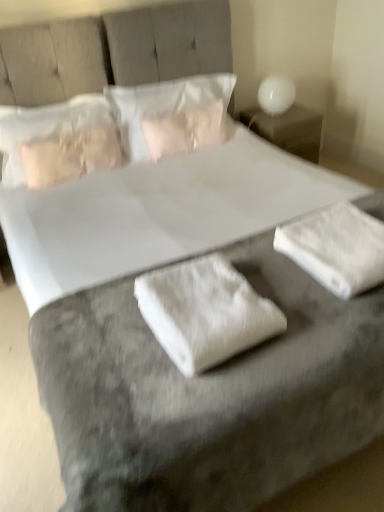
Find the location of `free point above white glossy nightstand at upper right (from a real-world perspective)`. free point above white glossy nightstand at upper right (from a real-world perspective) is located at coordinates (285, 116).